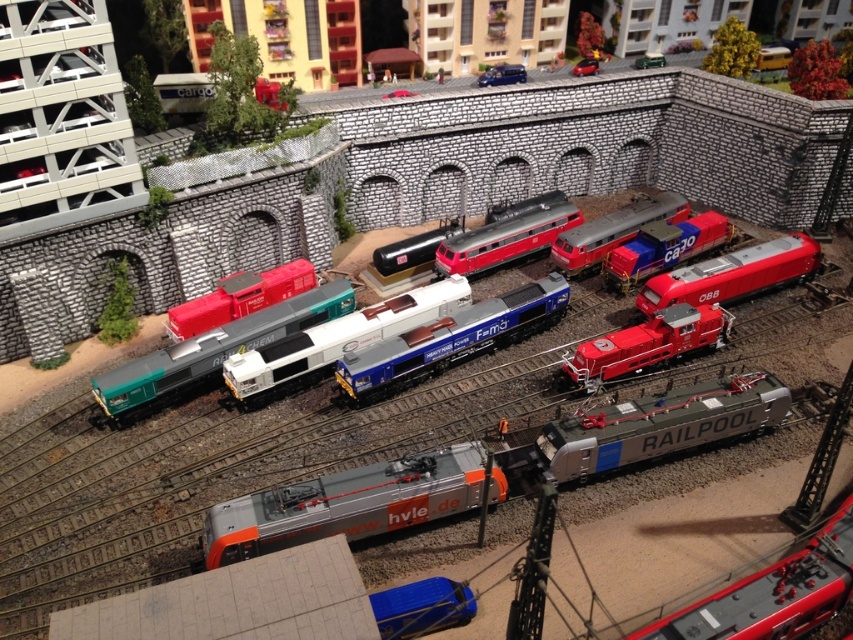
You are a model railway enthusiast inspecting the layout. You notice the blue metallic locomotive at center and the matte red train at center. Which of these two is placed lower in the scene?

The blue metallic locomotive at center is positioned under the matte red train at center, so it is placed lower in the scene.

In the scene shown: You are a model train enthusiast standing in front of the model railway scene. You notice the silver metallic locomotive at center and the matte red train at center. Which train is located to the left of the other?

The silver metallic locomotive at center is positioned on the left side of matte red train at center.